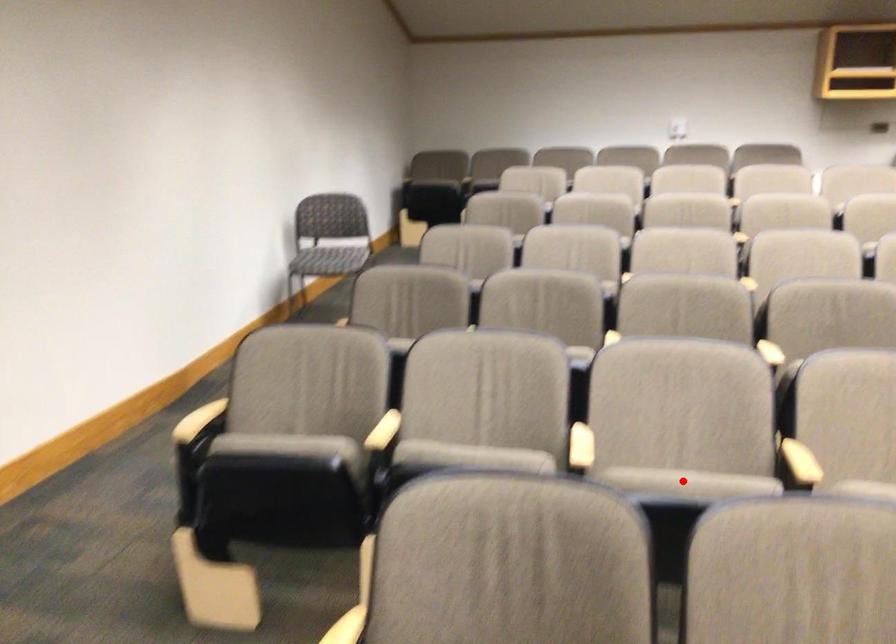
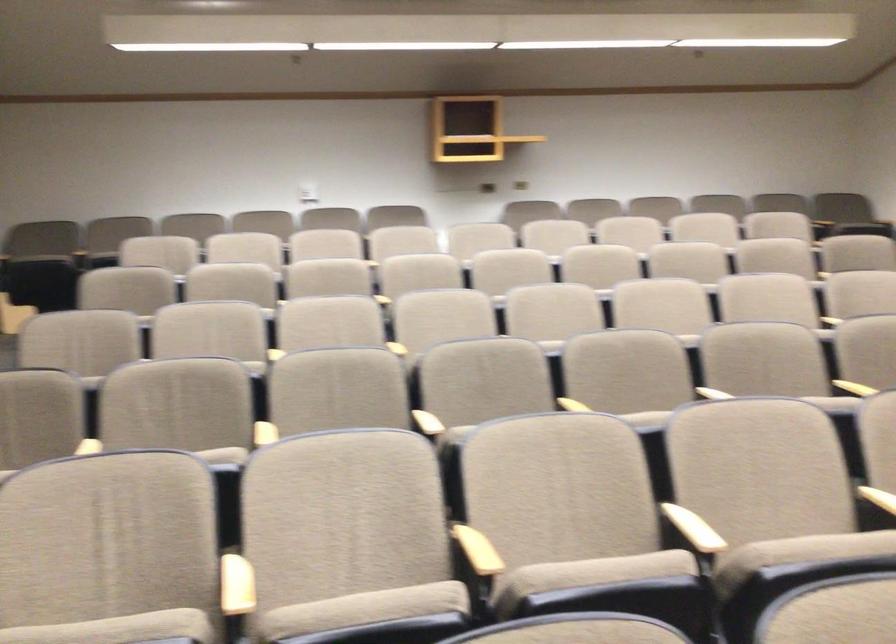
Question: I am providing you with two images of the same scene from different viewpoints. A red point is shown in image1. For the corresponding object point in image2, is it positioned nearer or farther from the camera?

Choices:
 (A) Nearer
 (B) Farther

Answer: (A)